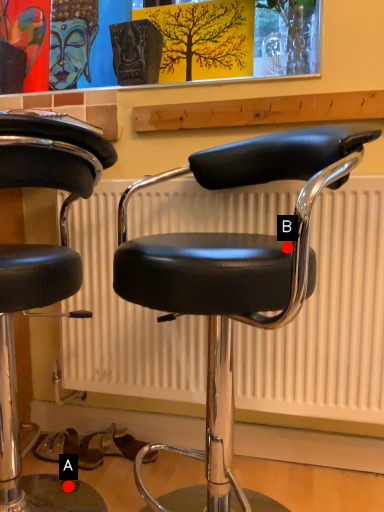
Question: Two points are circled on the image, labeled by A and B beside each circle. Which point appears closest to the camera in this image?

Choices:
 (A) A is closer
 (B) B is closer

Answer: (B)